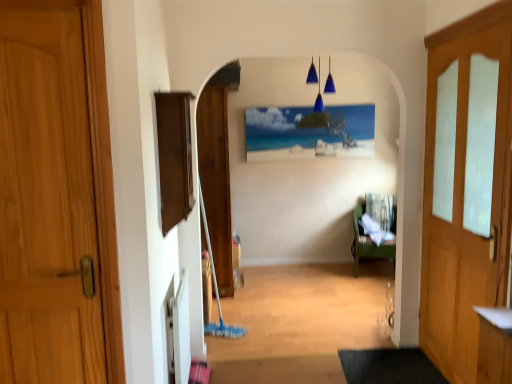
At what (x,y) coordinates should I click in order to perform the action: click on free point above dark gray rubber doormat at lower center (from a real-world perspective). Please return your answer as a coordinate pair (x, y). Looking at the image, I should click on click(x=393, y=361).